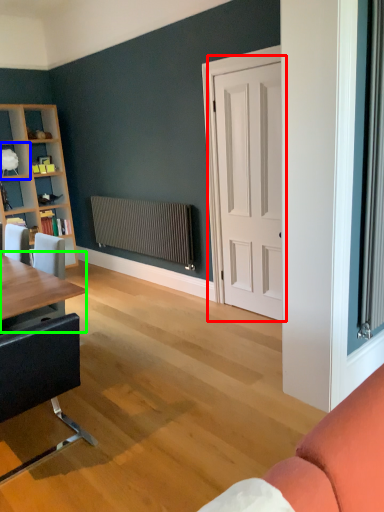
Question: Considering the real-world distances, which object is farthest from door (highlighted by a red box)? shelf (highlighted by a blue box) or table (highlighted by a green box)?

Choices:
 (A) shelf
 (B) table

Answer: (A)